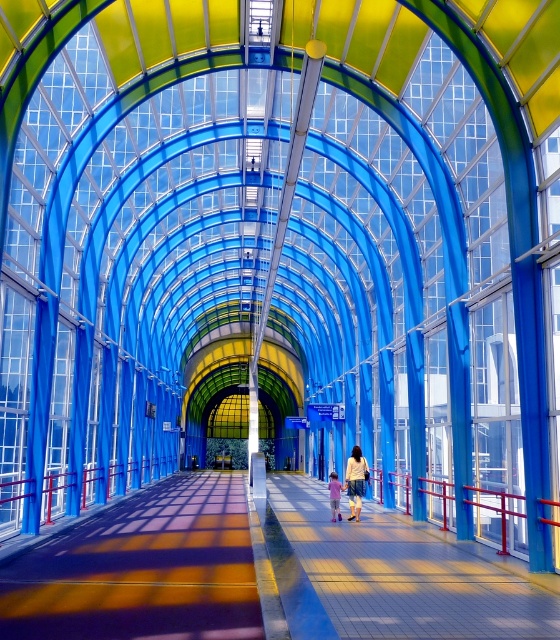
Question: Which point is farther from the camera taking this photo?

Choices:
 (A) (353, 554)
 (B) (254, 611)

Answer: (A)

Question: Estimate the real-world distances between objects in this image. Which object is farther from the pastel pink fabric at center?

Choices:
 (A) smooth concrete walkway at center
 (B) smooth concrete floor at center
 (C) denim shorts at center

Answer: (B)

Question: In this image, where is smooth concrete walkway at center located relative to pastel pink fabric at center?

Choices:
 (A) above
 (B) below

Answer: (B)

Question: Can you confirm if smooth concrete floor at center is smaller than denim shorts at center?

Choices:
 (A) no
 (B) yes

Answer: (A)

Question: Can you confirm if smooth concrete floor at center is positioned to the right of denim shorts at center?

Choices:
 (A) yes
 (B) no

Answer: (B)

Question: Among these points, which one is farthest from the camera?

Choices:
 (A) [x=63, y=580]
 (B) [x=354, y=497]
 (C) [x=358, y=634]
 (D) [x=329, y=500]

Answer: (D)